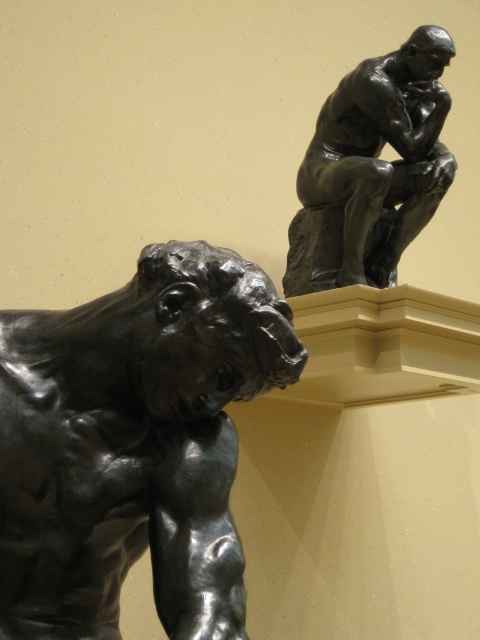
You are standing in front of the two sculptures. You want to take a photo of the point at coordinate point (216, 481). If your camera has a focal length of 50mm and you are 1.47 meters away from the point, what is the approximate angle of view needed to capture the entire scene? Use the formula angle of view in degrees equals 2 times arctangent of the sensor height divided by 2 times focal length, then multiply by the ratio of distance to focal length. Assume a full frame sensor with a height of 24mm.

The point at coordinate point (216, 481) is 1.47 meters away from the camera. Using the formula, the angle of view needed would be 2 times arctangent of 24mm divided by 2 times 50mm multiplied by 1.47 meters divided by 50mm. Calculating this gives an angle of approximately 2 times arctangent of 0.24 divided by 100mm times 1.47 meters. However, the exact calculation requires converting units properly. The correct angle of view is approximately 2 times arctangent of sensor height divided by 2 focal length,

You are an art curator planning to move the polished bronze muscular figure at lower left and the bronze statue at upper right to a new exhibition space. The new space has limited floor area. Which sculpture would require more floor space and why?

The bronze statue at upper right requires more floor space because it occupies more space than the polished bronze muscular figure at lower left according to the description.

You are standing in front of two sculptures. The first is the polished bronze muscular figure at lower left, and the second is the seated male figure in the background. If you want to take a photo of both sculptures in the same frame, which sculpture should you position closer to the camera to ensure both are fully visible?

To capture both sculptures in the same frame, position the polished bronze muscular figure at lower left closer to the camera since it is already at a lower position, allowing the background sculpture to be included without cropping.